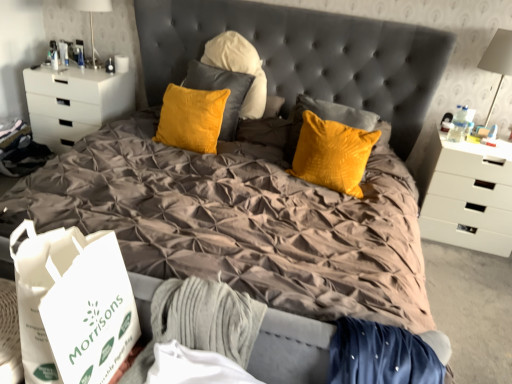
Question: Can you confirm if white matte chest of drawers at right, the 2th chest of drawers when ordered from left to right, is wider than white matte chest of drawers at left, positioned as the first chest of drawers in left-to-right order?

Choices:
 (A) no
 (B) yes

Answer: (B)

Question: Is the position of white matte chest of drawers at right, the first chest of drawers viewed from the right, more distant than that of white matte chest of drawers at left, positioned as the first chest of drawers in left-to-right order?

Choices:
 (A) yes
 (B) no

Answer: (B)

Question: Does white matte chest of drawers at right, the first chest of drawers viewed from the right, appear on the left side of white matte chest of drawers at left, placed as the 2th chest of drawers when sorted from right to left?

Choices:
 (A) no
 (B) yes

Answer: (A)

Question: Is white matte chest of drawers at right, the first chest of drawers viewed from the right, turned away from white matte chest of drawers at left, positioned as the first chest of drawers in left-to-right order?

Choices:
 (A) yes
 (B) no

Answer: (B)

Question: From the image's perspective, does white matte chest of drawers at right, the 2th chest of drawers when ordered from left to right, appear lower than white matte chest of drawers at left, placed as the 2th chest of drawers when sorted from right to left?

Choices:
 (A) no
 (B) yes

Answer: (B)

Question: Is white matte chest of drawers at right, the 2th chest of drawers when ordered from left to right, positioned beyond the bounds of white matte chest of drawers at left, positioned as the first chest of drawers in left-to-right order?

Choices:
 (A) yes
 (B) no

Answer: (A)

Question: Is white glossy table lamp at upper left, which is the 2th table lamp from bottom to top, aimed at white plastic table lamp at upper right, which is counted as the first table lamp, starting from the front?

Choices:
 (A) yes
 (B) no

Answer: (B)

Question: Is white glossy table lamp at upper left, which is the first table lamp in top-to-bottom order, next to white plastic table lamp at upper right, the 2th table lamp viewed from the back?

Choices:
 (A) yes
 (B) no

Answer: (B)

Question: Does white glossy table lamp at upper left, the 2th table lamp viewed from the front, have a larger size compared to white plastic table lamp at upper right, the second table lamp in the top-to-bottom sequence?

Choices:
 (A) yes
 (B) no

Answer: (B)

Question: Does white glossy table lamp at upper left, which appears as the 2th table lamp when viewed from the right, come in front of white plastic table lamp at upper right, the second table lamp in the top-to-bottom sequence?

Choices:
 (A) yes
 (B) no

Answer: (B)

Question: From a real-world perspective, is white glossy table lamp at upper left, which appears as the 2th table lamp when viewed from the right, located higher than white plastic table lamp at upper right, the 2th table lamp viewed from the back?

Choices:
 (A) yes
 (B) no

Answer: (B)

Question: Is white glossy table lamp at upper left, which is the 2th table lamp from bottom to top, wider than white plastic table lamp at upper right, the 1th table lamp when ordered from right to left?

Choices:
 (A) no
 (B) yes

Answer: (B)

Question: Can you see white matte chest of drawers at left, placed as the 2th chest of drawers when sorted from right to left, touching white glossy table lamp at upper left, the 2th table lamp viewed from the front?

Choices:
 (A) yes
 (B) no

Answer: (B)